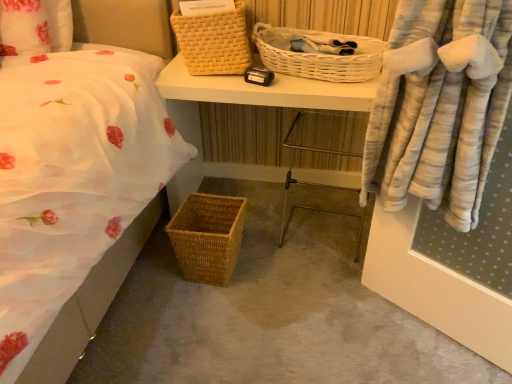
Question: Is woven brown picnic basket at lower left, the first picnic basket positioned from the bottom, positioned in front of white wicker picnic basket at upper center, the 2th picnic basket from the top?

Choices:
 (A) yes
 (B) no

Answer: (B)

Question: From the image's perspective, is woven brown picnic basket at lower left, the first picnic basket positioned from the bottom, on top of white wicker picnic basket at upper center, the 2th picnic basket ordered from the bottom?

Choices:
 (A) no
 (B) yes

Answer: (A)

Question: Considering the relative sizes of woven brown picnic basket at lower left, which ranks as the third picnic basket in top-to-bottom order, and white wicker picnic basket at upper center, the 2th picnic basket ordered from the bottom, in the image provided, is woven brown picnic basket at lower left, which ranks as the third picnic basket in top-to-bottom order, wider than white wicker picnic basket at upper center, the 2th picnic basket ordered from the bottom,?

Choices:
 (A) no
 (B) yes

Answer: (A)

Question: Considering the relative sizes of woven brown picnic basket at lower left, the first picnic basket positioned from the bottom, and white wicker picnic basket at upper center, the 2th picnic basket from the top, in the image provided, is woven brown picnic basket at lower left, the first picnic basket positioned from the bottom, thinner than white wicker picnic basket at upper center, the 2th picnic basket from the top,?

Choices:
 (A) yes
 (B) no

Answer: (A)

Question: Are woven brown picnic basket at lower left, the first picnic basket positioned from the bottom, and white wicker picnic basket at upper center, the 2th picnic basket ordered from the bottom, far apart?

Choices:
 (A) yes
 (B) no

Answer: (B)

Question: From a real-world perspective, relative to woven brown picnic basket at lower left, the first picnic basket positioned from the bottom, is white wicker picnic basket at upper center, the 2th picnic basket from the top, vertically above or below?

Choices:
 (A) above
 (B) below

Answer: (A)

Question: Considering the positions of white wicker picnic basket at upper center, the 2th picnic basket from the top, and woven brown picnic basket at lower left, which ranks as the third picnic basket in top-to-bottom order, in the image, is white wicker picnic basket at upper center, the 2th picnic basket from the top, taller or shorter than woven brown picnic basket at lower left, which ranks as the third picnic basket in top-to-bottom order,?

Choices:
 (A) tall
 (B) short

Answer: (B)

Question: In the image, is white wicker picnic basket at upper center, the 2th picnic basket ordered from the bottom, on the left side or the right side of woven brown picnic basket at lower left, the first picnic basket positioned from the bottom?

Choices:
 (A) left
 (B) right

Answer: (B)

Question: Is white wicker picnic basket at upper center, the 2th picnic basket from the top, wider or thinner than woven brown picnic basket at lower left, which ranks as the third picnic basket in top-to-bottom order?

Choices:
 (A) wide
 (B) thin

Answer: (A)

Question: From the image's perspective, relative to yellow woven picnic basket at upper center, arranged as the first picnic basket when viewed from the top, is woven brown picnic basket at lower left, the first picnic basket positioned from the bottom, above or below?

Choices:
 (A) above
 (B) below

Answer: (B)

Question: In terms of width, does woven brown picnic basket at lower left, the first picnic basket positioned from the bottom, look wider or thinner when compared to yellow woven picnic basket at upper center, arranged as the first picnic basket when viewed from the top?

Choices:
 (A) thin
 (B) wide

Answer: (A)

Question: In terms of height, does woven brown picnic basket at lower left, which ranks as the third picnic basket in top-to-bottom order, look taller or shorter compared to yellow woven picnic basket at upper center, arranged as the first picnic basket when viewed from the top?

Choices:
 (A) tall
 (B) short

Answer: (B)

Question: Is woven brown picnic basket at lower left, the first picnic basket positioned from the bottom, in front of or behind yellow woven picnic basket at upper center, arranged as the first picnic basket when viewed from the top, in the image?

Choices:
 (A) behind
 (B) front

Answer: (B)

Question: Choose the correct answer: Is woven brown picnic basket at lower left, which ranks as the third picnic basket in top-to-bottom order, inside metal frame chair at center or outside it?

Choices:
 (A) outside
 (B) inside

Answer: (A)

Question: In the image, is woven brown picnic basket at lower left, the first picnic basket positioned from the bottom, on the left side or the right side of metal frame chair at center?

Choices:
 (A) right
 (B) left

Answer: (B)